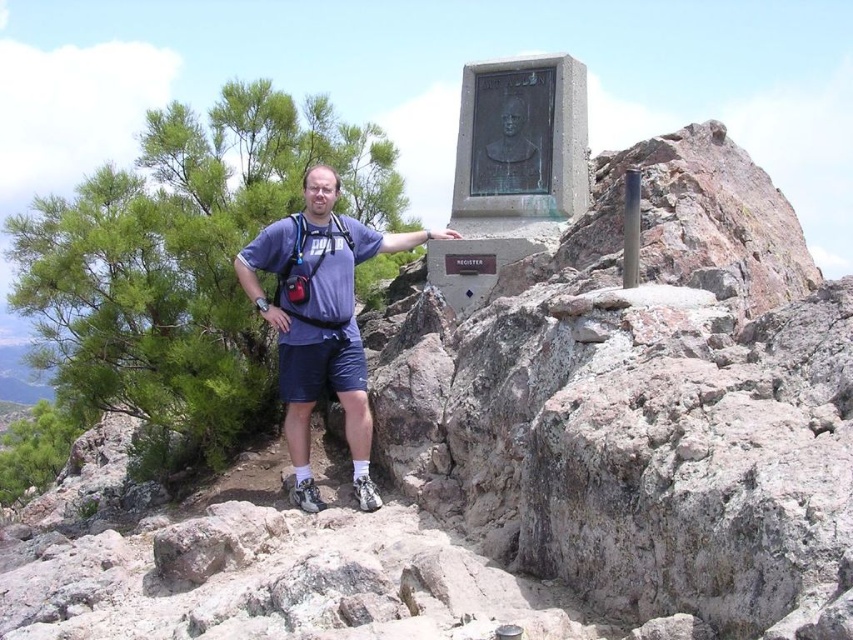
You are a photographer trying to capture a clear photo of the matte blue shirt at center and the green leafy pine at left. Which object should you adjust your camera focus to first to ensure both are in the frame?

The matte blue shirt at center is behind the green leafy pine at left, so you should focus on the matte blue shirt at center first to ensure both are in the frame.

Based on the photo, you are a photographer trying to capture a photo of the green leafy pine at left and the matte blue shirt at center. Which object should you focus on first if you want to ensure both are in sharp focus?

The green leafy pine at left is located below the matte blue shirt at center, so focusing on the matte blue shirt at center first will help ensure both are in sharp focus as the pine is closer to the camera.